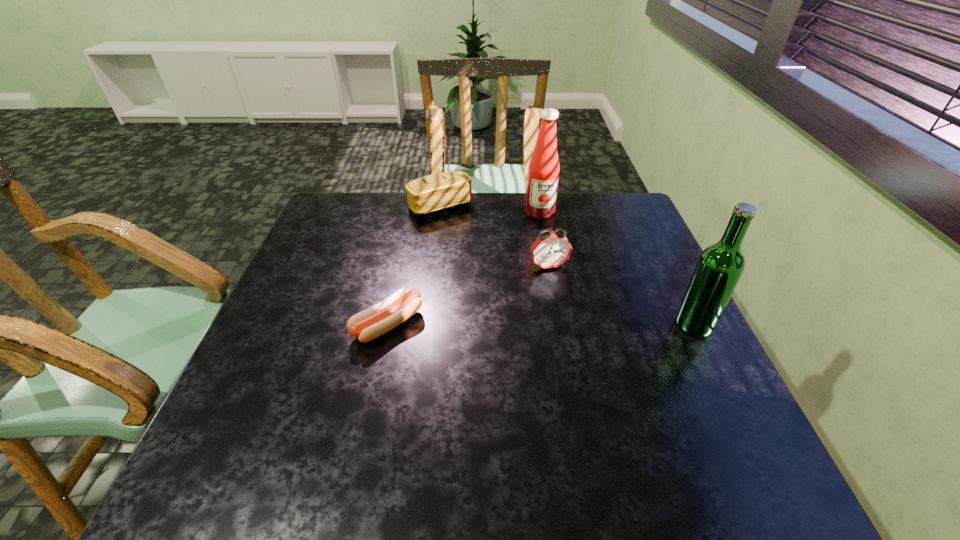
Find the location of `vacant region located 0.150m on the clock face of the alarm clock`. vacant region located 0.150m on the clock face of the alarm clock is located at coordinates (570, 310).

Find the location of a particular element. free space located on the zipper side of the fourth tallest object is located at coordinates (495, 280).

Identify the location of free location located on the zipper side of the fourth tallest object. The image size is (960, 540). (486, 267).

In order to click on vacant space situated on the zipper side of the fourth tallest object in this screenshot , I will do `click(500, 287)`.

This screenshot has width=960, height=540. I want to click on free spot located 0.320m on the front-facing side of the condiment, so click(564, 288).

This screenshot has width=960, height=540. I want to click on vacant space located on the front-facing side of the condiment, so click(x=547, y=237).

At what (x,y) coordinates should I click in order to perform the action: click on vacant space situated on the front-facing side of the condiment. Please return your answer as a coordinate pair (x, y). This screenshot has height=540, width=960. Looking at the image, I should click on (547, 237).

The height and width of the screenshot is (540, 960). I want to click on clutch bag that is at the far edge, so click(439, 191).

You are a GUI agent. You are given a task and a screenshot of the screen. Output one action in this format:
    pyautogui.click(x=<x>, y=<y>)
    Task: Click on the condiment that is at the far edge
    This screenshot has width=960, height=540.
    Given the screenshot: What is the action you would take?
    pyautogui.click(x=543, y=172)

Locate an element on the screen. Image resolution: width=960 pixels, height=540 pixels. object that is positioned at the right edge is located at coordinates (720, 266).